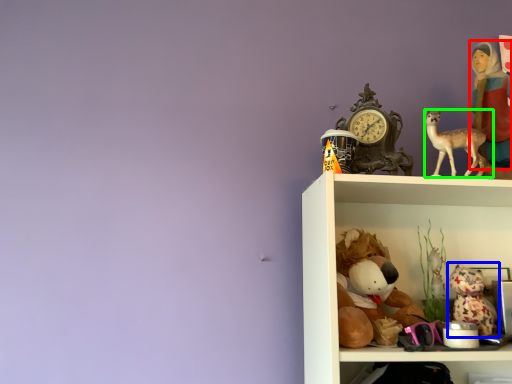
Question: Considering the real-world distances, which object is farthest from person (highlighted by a red box)? toy (highlighted by a blue box) or deer (highlighted by a green box)?

Choices:
 (A) toy
 (B) deer

Answer: (A)